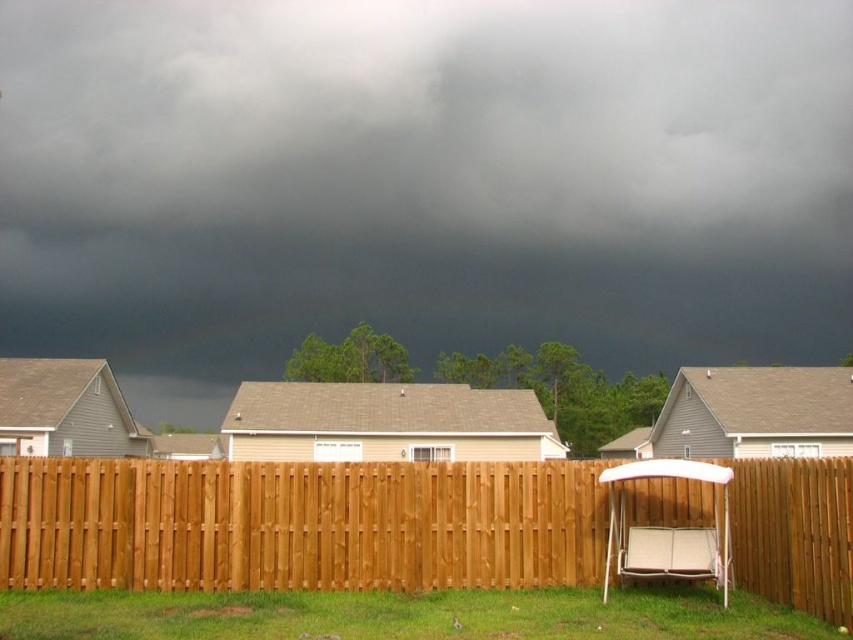
You are a delivery person trying to deliver a package to a house in this neighborhood. You are standing on the green grass at lower center and need to reach the brown wooden fence at center. Can you walk directly to the fence without stepping on any other objects?

The distance between the brown wooden fence at center and the green grass at lower center is 4.13 feet, so yes, you can walk directly to the fence without stepping on any other objects since there is enough space between them.

You are a child standing in the backyard and want to look at the dark gray cloud at upper center. Since the green grass at lower center is in the way, can you see the cloud by moving forward a little?

The dark gray cloud at upper center is much taller than the green grass at lower center, so moving forward a little would allow you to see the cloud over the grass.

You are standing in the residential neighborhood and want to take a photo of the brown wooden fence at center without the dark gray cloud at upper center blocking it. How can you adjust your position to achieve this?

The brown wooden fence at center is behind the dark gray cloud at upper center, so you should move your position to the right side of the image where the swing with a white canopy is partially visible. This will allow you to frame the photo so the brown wooden fence at center is no longer obstructed by the cloud.